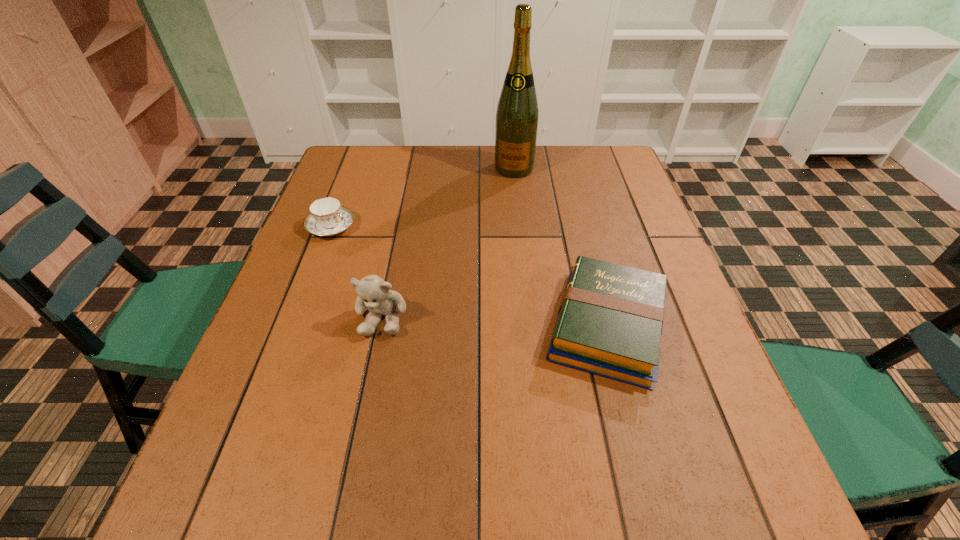
Identify the location of vacant space at the left edge. This screenshot has height=540, width=960. tap(315, 297).

This screenshot has height=540, width=960. Identify the location of vacant space at the right edge of the desktop. pos(647,393).

Locate an element on the screen. This screenshot has width=960, height=540. free space at the far left corner of the desktop is located at coordinates (336, 178).

Identify the location of vacant point at the near left corner. (250, 427).

In order to click on vacant space that's between the book and the wine bottle in this screenshot , I will do `click(561, 247)`.

At what (x,y) coordinates should I click in order to perform the action: click on vacant region between the leftmost object and the tallest object. Please return your answer as a coordinate pair (x, y). Looking at the image, I should click on (422, 198).

Image resolution: width=960 pixels, height=540 pixels. What are the coordinates of `free space between the leftmost object and the second object from left to right` in the screenshot? It's located at point(357,272).

Where is `free space between the wine bottle and the book`? The image size is (960, 540). free space between the wine bottle and the book is located at coordinates (561, 247).

This screenshot has height=540, width=960. Find the location of `blank region between the second farthest object and the third object from right to left`. blank region between the second farthest object and the third object from right to left is located at coordinates point(357,272).

Where is `free space between the teacup and the tallest object`? free space between the teacup and the tallest object is located at coordinates (422, 198).